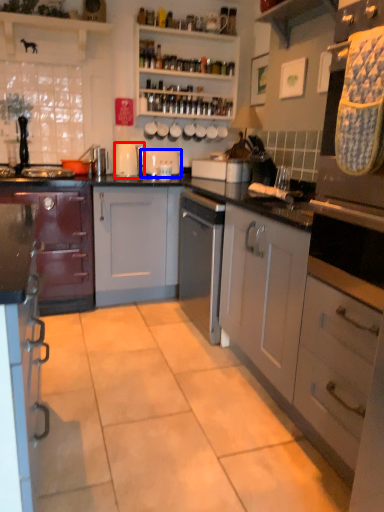
Question: Which of the following is the farthest to the observer, kitchen appliance (highlighted by a red box) or appliance (highlighted by a blue box)?

Choices:
 (A) kitchen appliance
 (B) appliance

Answer: (B)